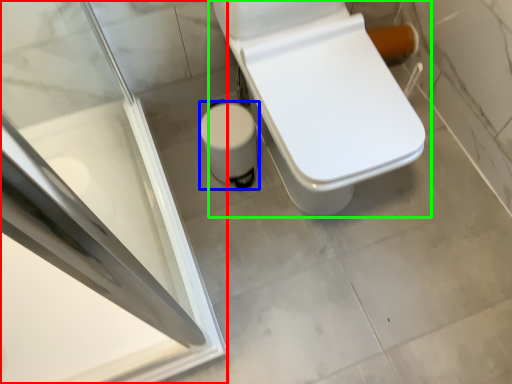
Question: Based on their relative distances, which object is farther from screen door (highlighted by a red box)? Choose from potty (highlighted by a blue box) and toilet (highlighted by a green box).

Choices:
 (A) potty
 (B) toilet

Answer: (B)